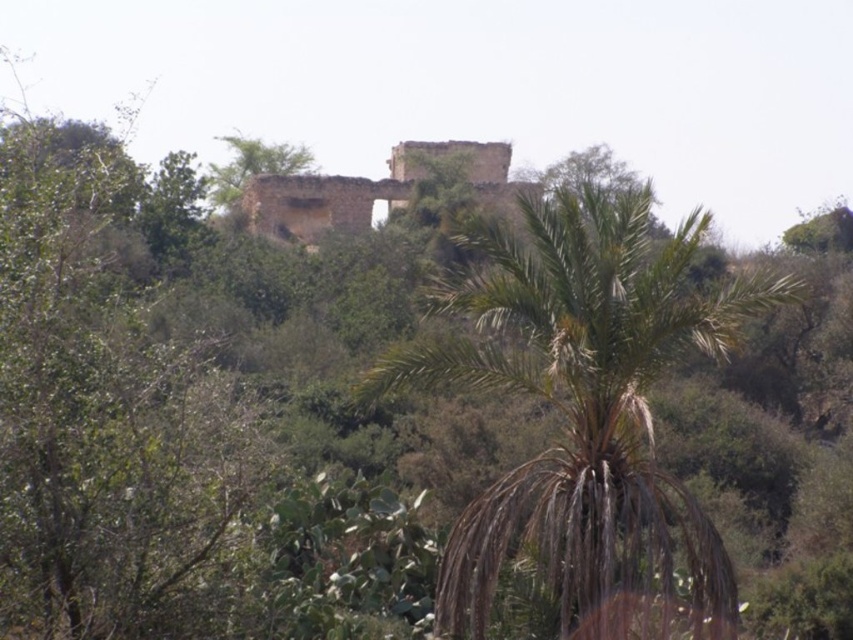
Which is more to the right, brown textured palm tree at center or weathered stone castle at center?

From the viewer's perspective, brown textured palm tree at center appears more on the right side.

Which is in front, point (399, 352) or point (445, 163)?

Point (399, 352) is more forward.

Which is behind, point (624, 550) or point (490, 141)?

The point (490, 141) is behind.

Locate an element on the screen. The width and height of the screenshot is (853, 640). brown textured palm tree at center is located at coordinates (582, 408).